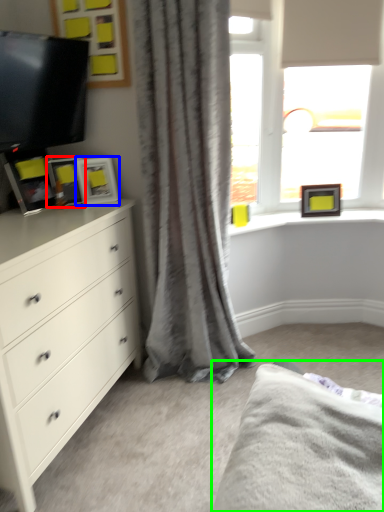
Question: Considering the real-world distances, which object is closest to picture frame (highlighted by a red box)? picture frame (highlighted by a blue box) or bed frame (highlighted by a green box).

Choices:
 (A) picture frame
 (B) bed frame

Answer: (A)